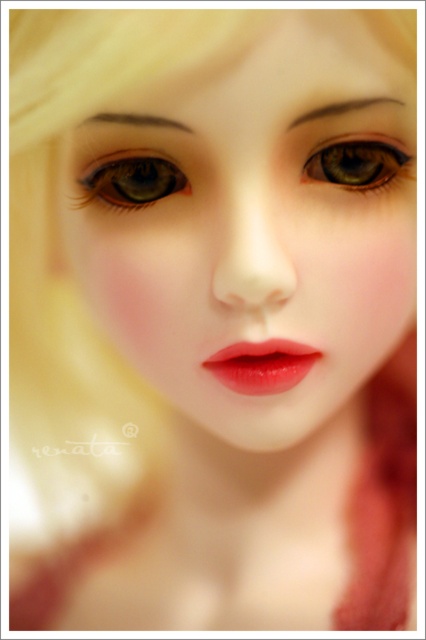
Can you confirm if smooth porcelain face at center is wider than glossy matte lips at center?

Indeed, smooth porcelain face at center has a greater width compared to glossy matte lips at center.

Between point (270, 410) and point (293, 349), which one is positioned behind?

The point (270, 410) is behind.

Identify the location of smooth porcelain face at center. (253, 221).

Does matte green eye at center have a smaller size compared to glossy matte lips at center?

No.

This screenshot has width=426, height=640. I want to click on matte green eye at center, so click(x=132, y=179).

Does glossy matte lips at center come in front of brown glossy eye at upper center?

No, it is not.

Can you confirm if glossy matte lips at center is positioned below brown glossy eye at upper center?

Yes.

Image resolution: width=426 pixels, height=640 pixels. I want to click on glossy matte lips at center, so click(x=261, y=365).